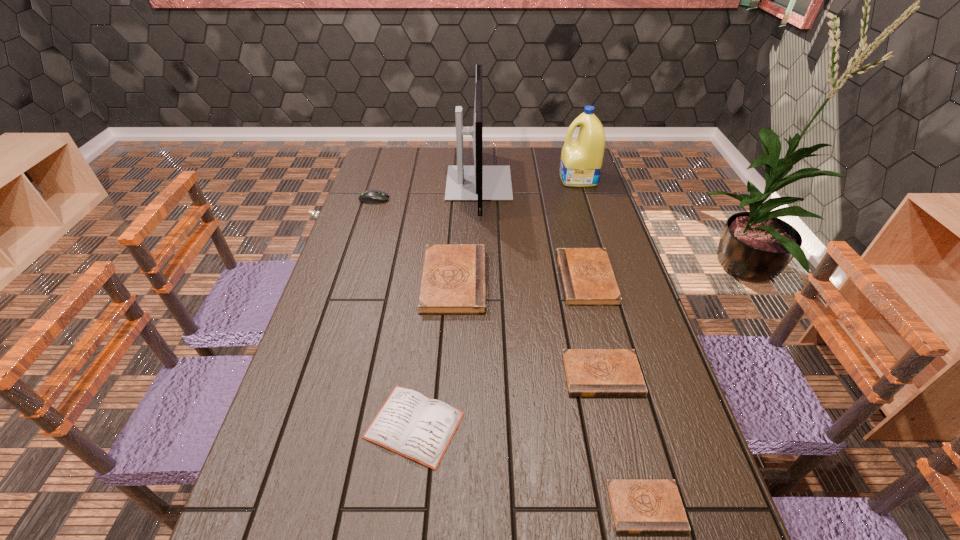
Where is `diary identified as the fourth closest to the leftmost brown diary`? The image size is (960, 540). diary identified as the fourth closest to the leftmost brown diary is located at coordinates (638, 506).

Select which diary is the second closest to the white diary. Please provide its 2D coordinates. Your answer should be formatted as a tuple, i.e. [(x, y)], where the tuple contains the x and y coordinates of a point satisfying the conditions above.

[(589, 372)]

Locate an element on the screen. This screenshot has width=960, height=540. the second closest brown diary to the white diary is located at coordinates (589, 372).

Locate which brown diary is the third closest to the detergent. Please provide its 2D coordinates. Your answer should be formatted as a tuple, i.e. [(x, y)], where the tuple contains the x and y coordinates of a point satisfying the conditions above.

[(589, 372)]

Find the location of a particular element. This screenshot has width=960, height=540. free space that satisfies the following two spatial constraints: 1. on the wheel side of the white diary; 2. on the right side of the computer mouse is located at coordinates (303, 425).